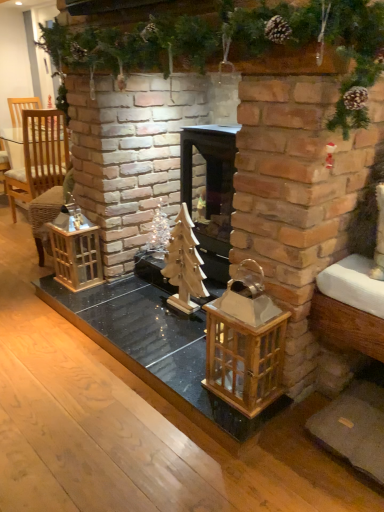
The image size is (384, 512). Identify the location of free location in front of wooden christmas tree at center. [170, 332].